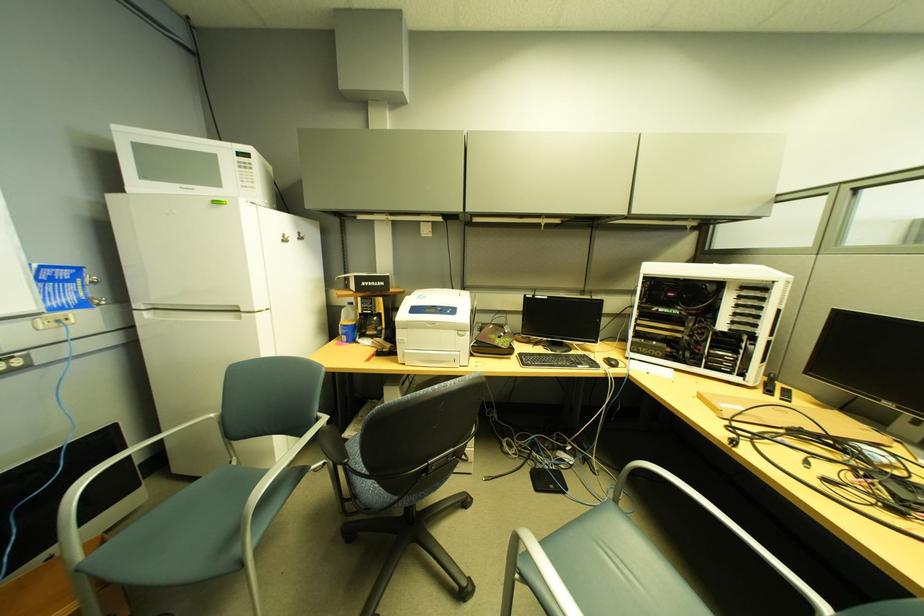
The location [347,323] corresponds to which object?

This point indicates the clear water bottle.